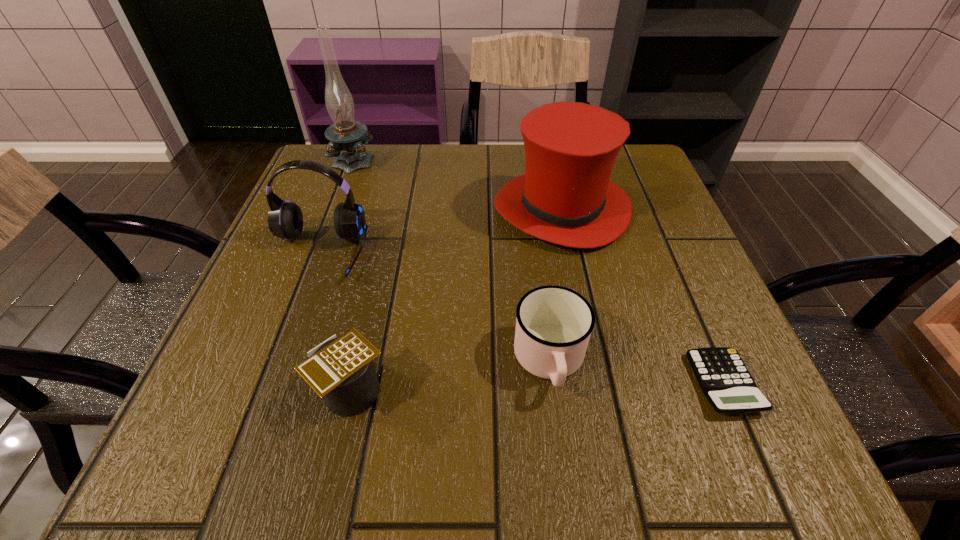
Locate an element on the screen. the tallest object is located at coordinates (346, 136).

Where is `hat`? hat is located at coordinates (565, 197).

Identify the location of headset. The image size is (960, 540). (285, 220).

This screenshot has width=960, height=540. I want to click on mug, so click(553, 326).

Identify the location of the taller calculator. This screenshot has width=960, height=540. (340, 370).

At what (x,y) coordinates should I click in order to perform the action: click on the shorter calculator. Please return your answer as a coordinate pair (x, y). This screenshot has height=540, width=960. Looking at the image, I should click on (724, 379).

Image resolution: width=960 pixels, height=540 pixels. I want to click on the right calculator, so click(724, 379).

The height and width of the screenshot is (540, 960). Find the location of `vacant space situated 0.280m on the front of the tallest object`. vacant space situated 0.280m on the front of the tallest object is located at coordinates (319, 253).

The width and height of the screenshot is (960, 540). Find the location of `vacant space located on the front of the hat`. vacant space located on the front of the hat is located at coordinates (612, 446).

Locate an element on the screen. vacant space located 0.310m on the ear cushions of the headset is located at coordinates (244, 453).